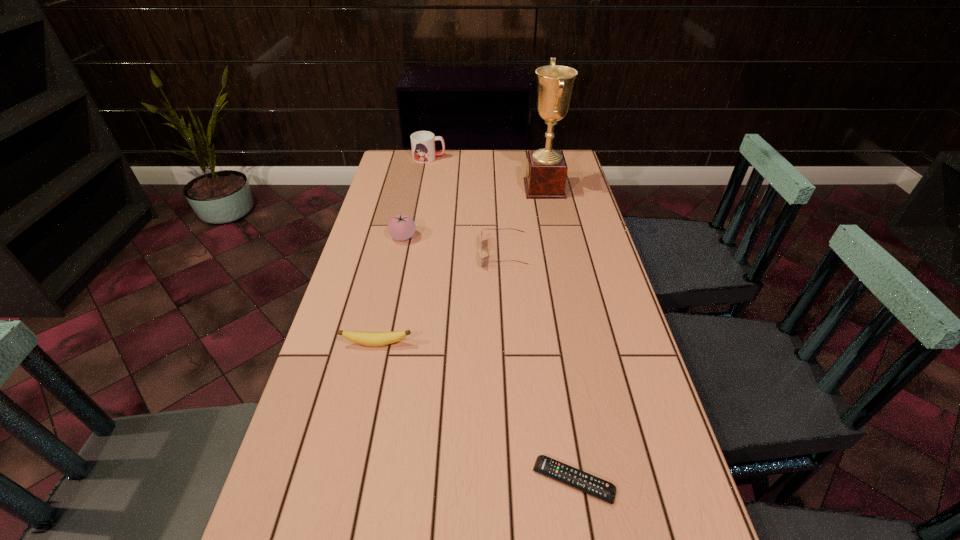
This screenshot has height=540, width=960. I want to click on free spot between the shortest object and the second nearest object, so click(475, 413).

Where is `vacant space that is in between the mug and the nearest object`? vacant space that is in between the mug and the nearest object is located at coordinates (501, 319).

Locate an element on the screen. Image resolution: width=960 pixels, height=540 pixels. object that is the third closest to the farthest object is located at coordinates (482, 229).

Find the location of a particular element. the closest object to the mug is located at coordinates (546, 173).

Find the location of a particular element. The image size is (960, 540). free space that satisfies the following two spatial constraints: 1. on the side of the fifth shortest object with the handle; 2. on the left side of the nearest object is located at coordinates (371, 481).

Find the location of `blank area in the image that satisfies the following two spatial constraints: 1. on the front-facing side of the sunglasses; 2. on the left side of the nearest object`. blank area in the image that satisfies the following two spatial constraints: 1. on the front-facing side of the sunglasses; 2. on the left side of the nearest object is located at coordinates (518, 481).

Identify the location of vacant area that satisfies the following two spatial constraints: 1. on the side of the farthest object with the handle; 2. on the right side of the nearest object. (371, 481).

Identify the location of free space that satisfies the following two spatial constraints: 1. on the front side of the third tallest object; 2. on the right side of the remote control. Image resolution: width=960 pixels, height=540 pixels. (350, 481).

Image resolution: width=960 pixels, height=540 pixels. Find the location of `free space that satisfies the following two spatial constraints: 1. on the side of the remote control with the handle; 2. on the right side of the second tallest object`. free space that satisfies the following two spatial constraints: 1. on the side of the remote control with the handle; 2. on the right side of the second tallest object is located at coordinates (371, 481).